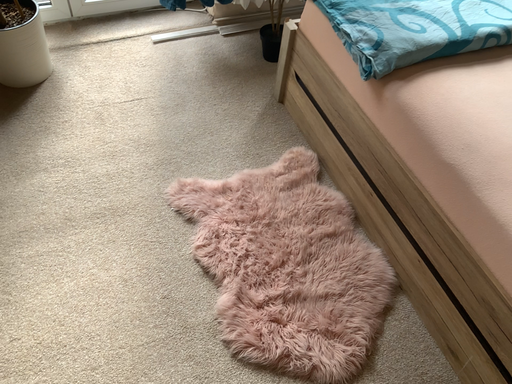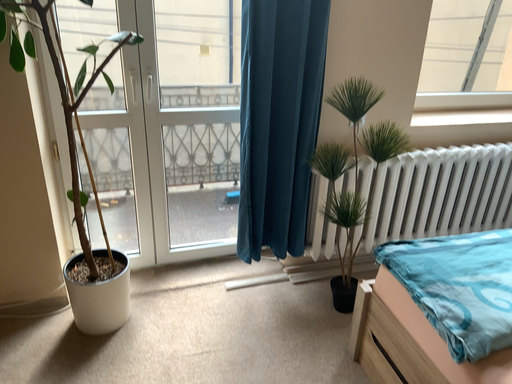
Question: Which way did the camera rotate in the video?

Choices:
 (A) rotated right
 (B) rotated left

Answer: (B)